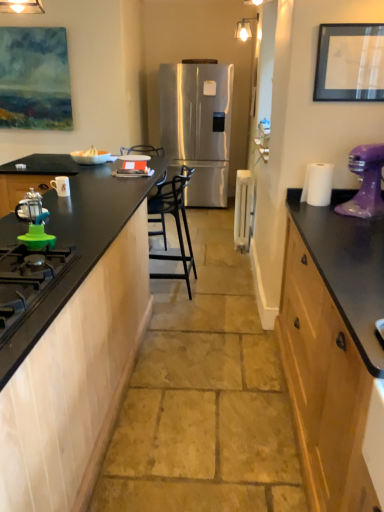
Question: Choose the correct answer: Is stainless steel refrigerator at center inside green rubber gas stove at lower left or outside it?

Choices:
 (A) outside
 (B) inside

Answer: (A)

Question: Considering the positions of stainless steel refrigerator at center and green rubber gas stove at lower left in the image, is stainless steel refrigerator at center taller or shorter than green rubber gas stove at lower left?

Choices:
 (A) short
 (B) tall

Answer: (B)

Question: Based on their relative distances, which object is nearer to the black matte picture frame at upper right?

Choices:
 (A) white plastic radiator at center, the 1th appliance viewed from the right
 (B) black metal chair at center
 (C) stainless steel refrigerator at center
 (D) green plastic lid at lower left, positioned as the fourth appliance in left-to-right order
 (E) matte black coffee press at left, which is the fourth appliance in back-to-front order

Answer: (B)

Question: Considering the real-world distances, which object is closest to the black matte picture frame at upper right?

Choices:
 (A) green rubber gas stove at lower left
 (B) green plastic lid at lower left, placed as the second appliance when sorted from right to left
 (C) purple glossy stand mixer at right
 (D) white matte bowl at center, marked as the 1th appliance in a left-to-right arrangement
 (E) black metal chair at center

Answer: (C)